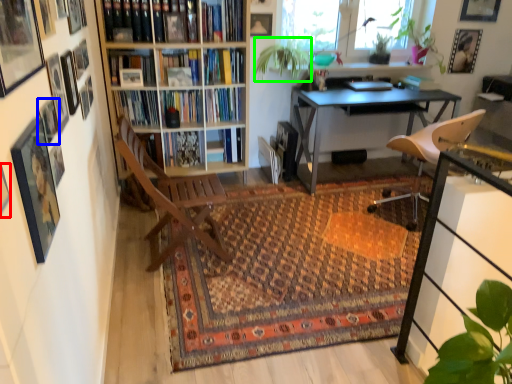
Question: Which is farther away from picture frame (highlighted by a red box)? picture frame (highlighted by a blue box) or plant (highlighted by a green box)?

Choices:
 (A) picture frame
 (B) plant

Answer: (B)